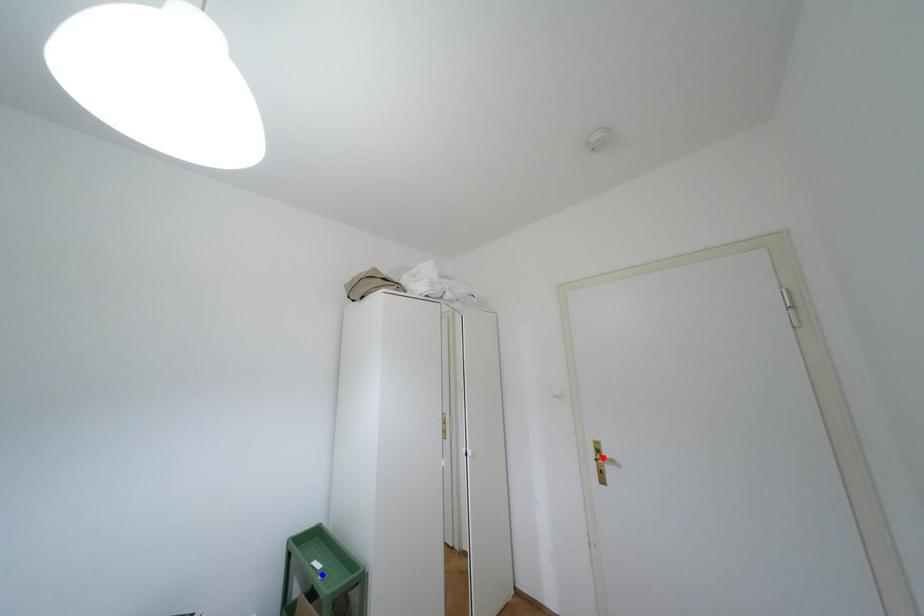
Question: Which of the two points in the image is closer to the camera?

Choices:
 (A) Blue point is closer.
 (B) Red point is closer.

Answer: (A)